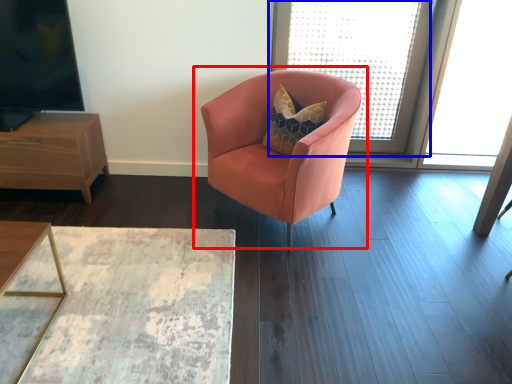
Question: Among these objects, which one is nearest to the camera, chair (highlighted by a red box) or window screen (highlighted by a blue box)?

Choices:
 (A) chair
 (B) window screen

Answer: (A)